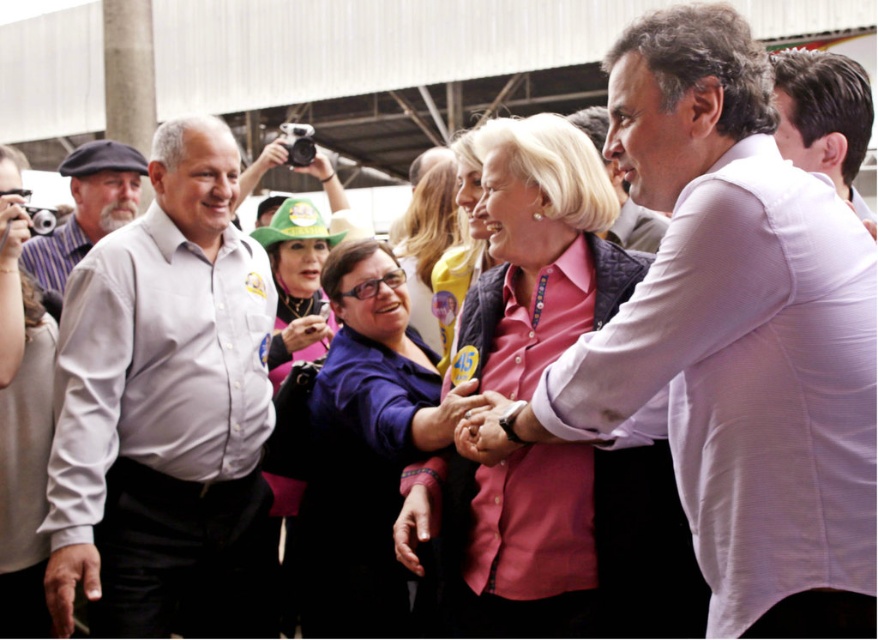
Question: Does white shirt at center have a smaller size compared to matte gray cap at left?

Choices:
 (A) no
 (B) yes

Answer: (A)

Question: Which point is closer to the camera?

Choices:
 (A) click(444, 209)
 (B) click(825, 161)
 (C) click(631, 250)
 (D) click(312, 448)

Answer: (B)

Question: Estimate the real-world distances between objects in this image. Which object is closer to the pink fabric at center?

Choices:
 (A) white shirt at center
 (B) purple matte shirt at center

Answer: (B)

Question: Based on their relative distances, which object is nearer to the purple matte shirt at center?

Choices:
 (A) pink fabric at center
 (B) pink quilted vest at center
 (C) matte gray cap at left

Answer: (B)

Question: Does light gray shirt at left have a greater width compared to matte gray shirt at upper left?

Choices:
 (A) no
 (B) yes

Answer: (B)

Question: Considering the relative positions of white shirt at upper right and matte gray cap at left in the image provided, where is white shirt at upper right located with respect to matte gray cap at left?

Choices:
 (A) left
 (B) right

Answer: (B)